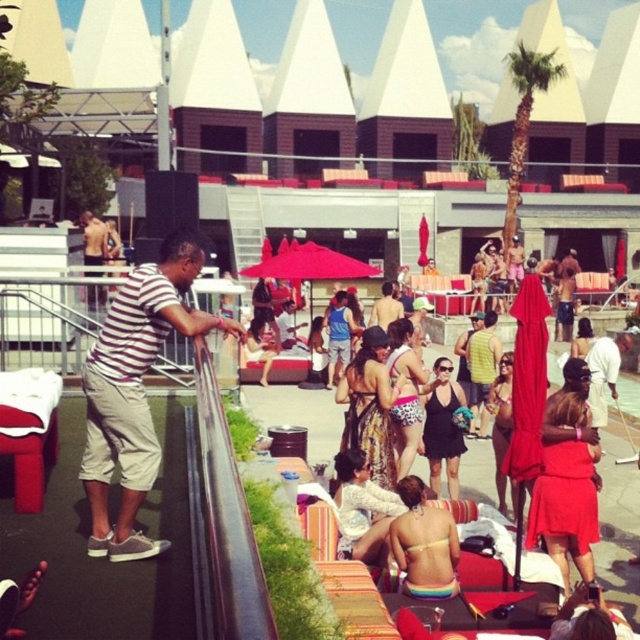
Is striped cotton shirt at left closer to the viewer compared to rainbow bikini at center?

That is True.

Measure the distance between striped cotton shirt at left and rainbow bikini at center.

The distance of striped cotton shirt at left from rainbow bikini at center is 8.78 feet.

Who is more distant from viewer, [125,500] or [413,516]?

Positioned behind is point [413,516].

Locate an element on the screen. The image size is (640, 640). striped cotton shirt at left is located at coordinates (134, 392).

Which of these two, rainbow bikini at center or green leafy palm tree at upper right, stands shorter?

rainbow bikini at center is shorter.

In the scene shown: Is rainbow bikini at center above green leafy palm tree at upper right?

No, rainbow bikini at center is not above green leafy palm tree at upper right.

Who is more distant from viewer, (456, 589) or (516, 204)?

Result: Point (516, 204)

I want to click on rainbow bikini at center, so click(424, 544).

Between point (100, 404) and point (506, 234), which one is positioned behind?

Point (506, 234)

Is striped cotton shirt at left behind green leafy palm tree at upper right?

No, it is not.

Describe the element at coordinates (134, 392) in the screenshot. This screenshot has height=640, width=640. I see `striped cotton shirt at left` at that location.

Identify the location of striped cotton shirt at left. This screenshot has width=640, height=640. (134, 392).